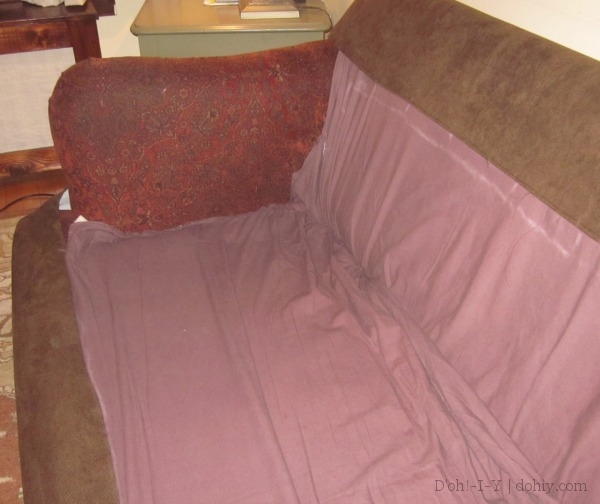
Identify the location of end table. The width and height of the screenshot is (600, 504). (186, 22).